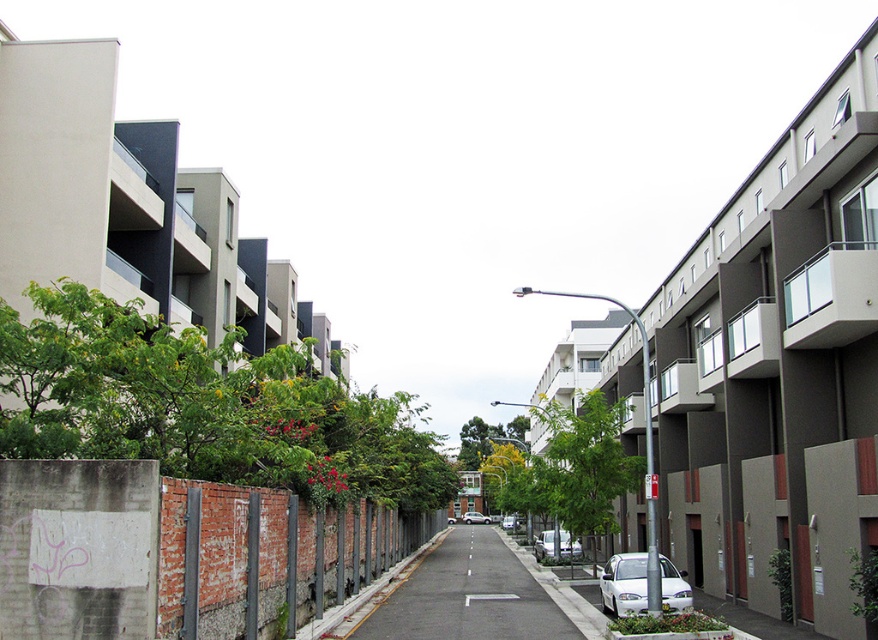
You are a delivery driver who needs to park your truck, which is 3 meters wide, on the asphalt road at center. The green leafy tree at left is blocking part of the road. Can you park your truck there without hitting the tree?

The green leafy tree at left is larger in size than asphalt road at center. Since the tree is bigger than the road, it might occupy more space, making it difficult to park the 3m wide truck without hitting the tree. Check the available space carefully.

You are a city planner assessing the street layout for a new bike lane. The bike lane requires a minimum width of 1.5 meters between the green leafy tree at left and the green leafy tree at center. Based on the scene provided, will the space between these two trees meet the requirement?

The green leafy tree at left is wider than the green leafy tree at center. However, the description only provides information about their widths, not the distance between them. Therefore, it is impossible to determine if the space between them meets the 1.5 meter requirement based on the given information.